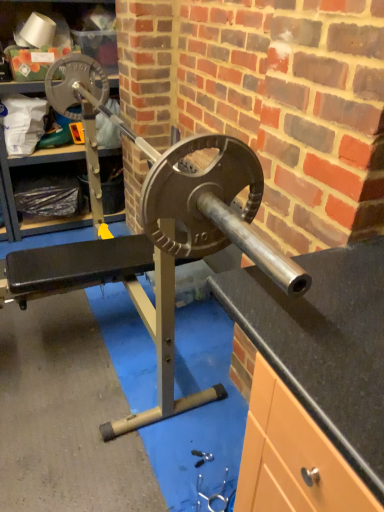
Question: Is metallic silver tool at lower center taller or shorter than matte black weight at left?

Choices:
 (A) short
 (B) tall

Answer: (A)

Question: Relative to matte black weight at left, is metallic silver tool at lower center in front or behind?

Choices:
 (A) front
 (B) behind

Answer: (A)

Question: From a real-world perspective, is metallic silver tool at lower center above or below matte black weight at left?

Choices:
 (A) below
 (B) above

Answer: (A)

Question: Does point (52, 223) appear closer or farther from the camera than point (195, 450)?

Choices:
 (A) closer
 (B) farther

Answer: (B)

Question: Based on their sizes in the image, would you say matte black weight at left is bigger or smaller than metallic silver tool at lower center?

Choices:
 (A) small
 (B) big

Answer: (B)

Question: From the image's perspective, relative to metallic silver tool at lower center, is matte black weight at left above or below?

Choices:
 (A) below
 (B) above

Answer: (B)

Question: Looking at their shapes, would you say matte black weight at left is wider or thinner than metallic silver tool at lower center?

Choices:
 (A) thin
 (B) wide

Answer: (B)